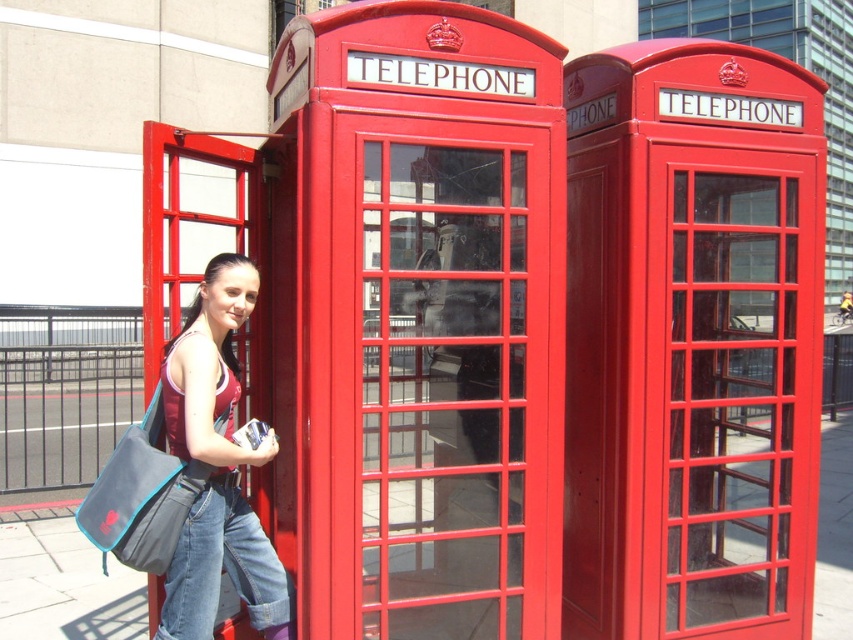
From the picture: Does metallic red telephone booth at right have a smaller size compared to matte fabric tank top at center?

Incorrect, metallic red telephone booth at right is not smaller in size than matte fabric tank top at center.

Does metallic red telephone booth at right lie in front of matte fabric tank top at center?

No.

Does point (599, 284) come in front of point (273, 564)?

No, (599, 284) is further to viewer.

You are a GUI agent. You are given a task and a screenshot of the screen. Output one action in this format:
    pyautogui.click(x=<x>, y=<y>)
    Task: Click on the metallic red telephone booth at right
    The height and width of the screenshot is (640, 853).
    Given the screenshot: What is the action you would take?
    pyautogui.click(x=692, y=340)

In the scene shown: Does matte red telephone at center have a smaller size compared to metallic red telephone booth at right?

Correct, matte red telephone at center occupies less space than metallic red telephone booth at right.

Is matte red telephone at center further to the viewer compared to metallic red telephone booth at right?

That is False.

Which is behind, point (453, 444) or point (701, 576)?

The point (453, 444) is behind.

Identify the location of matte red telephone at center. (416, 321).

Which is above, matte red telephone at center or matte fabric tank top at center?

matte red telephone at center is higher up.

Can you confirm if matte red telephone at center is smaller than matte fabric tank top at center?

Incorrect, matte red telephone at center is not smaller in size than matte fabric tank top at center.

Does point (500, 170) come behind point (224, 387)?

Yes, point (500, 170) is farther from viewer.

Locate an element on the screen. The width and height of the screenshot is (853, 640). matte red telephone at center is located at coordinates (416, 321).